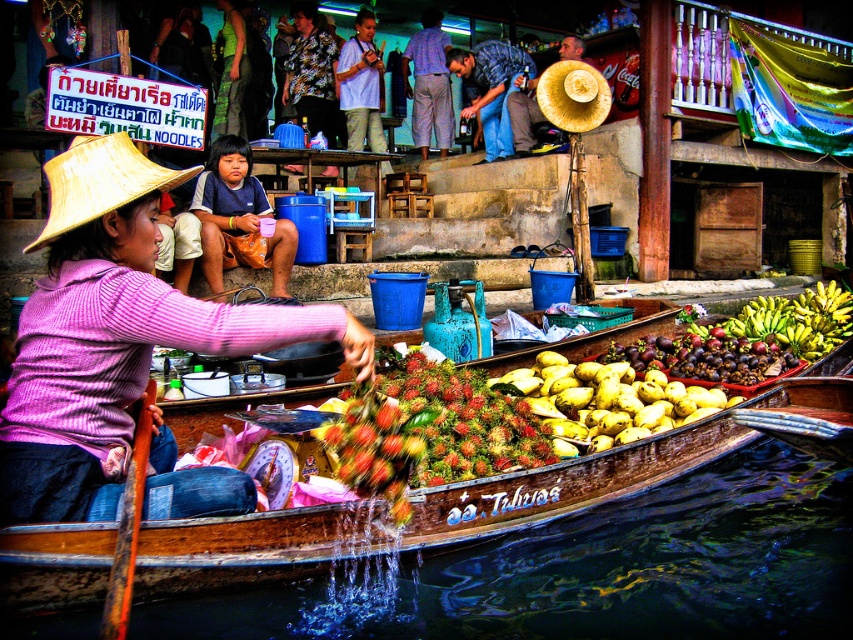
You are a customer at the floating market and want to buy some tropical fruits. The vendor in the pink striped sweater is standing at point (114, 333). Where should you go to find the vendor?

The vendor in the pink striped sweater is located at point (114, 333), so you should go to that coordinate to find them.

You are a customer at the floating market and want to buy a ruddy spiky rambutan at center. The vendor points to a specific location on the fruit using coordinates. What part of the ruddy spiky rambutan at center is the vendor indicating with point (462,420)?

The point (462,420) is on the ruddy spiky rambutan at center, so the vendor is indicating a specific part of the fruit itself.

Consider the image. You are a customer at the floating market and want to buy the ruddy spiky rambutan at center and the light blue shirt at center. Which item is wider?

The ruddy spiky rambutan at center is wider than the light blue shirt at center.